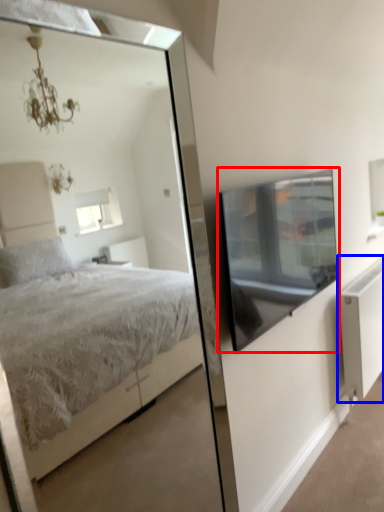
Question: Among these objects, which one is farthest to the camera, window screen (highlighted by a red box) or radiator (highlighted by a blue box)?

Choices:
 (A) window screen
 (B) radiator

Answer: (B)